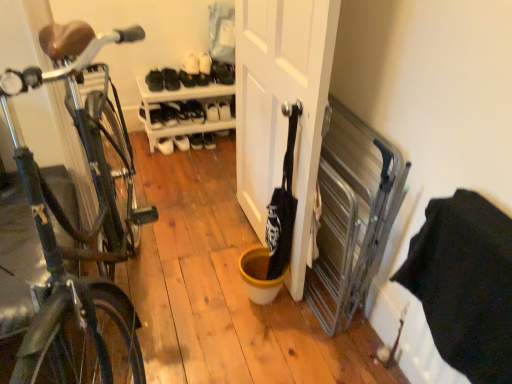
Find the location of a particular element. free space in front of white matte door at center is located at coordinates [x=233, y=325].